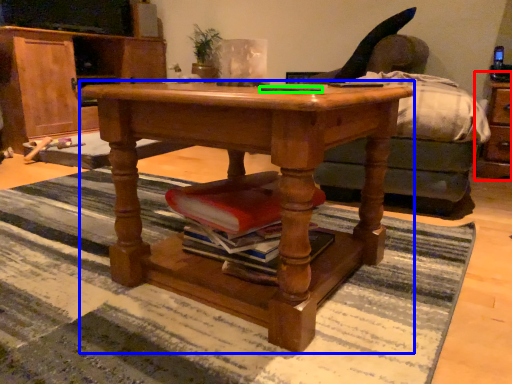
Question: Considering the real-world distances, which object is farthest from dresser (highlighted by a red box)? desk (highlighted by a blue box) or remote control (highlighted by a green box)?

Choices:
 (A) desk
 (B) remote control

Answer: (A)